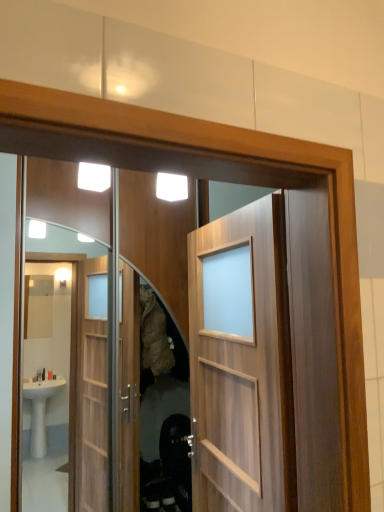
Find the location of a particular element. The height and width of the screenshot is (512, 384). wooden door at center is located at coordinates (241, 362).

What do you see at coordinates (241, 362) in the screenshot? The image size is (384, 512). I see `wooden door at center` at bounding box center [241, 362].

In order to click on wooden door at center in this screenshot , I will do `click(241, 362)`.